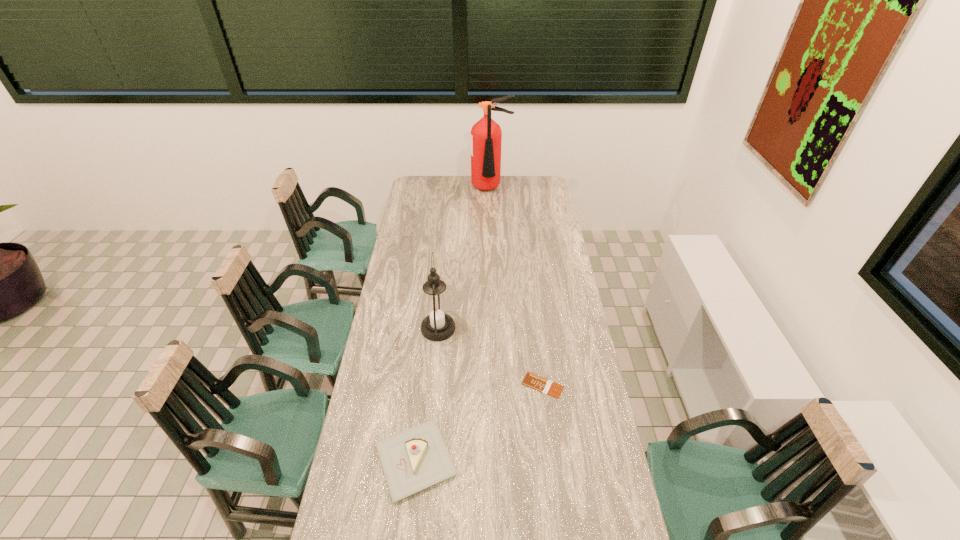
You are a GUI agent. You are given a task and a screenshot of the screen. Output one action in this format:
    pyautogui.click(x=<x>, y=<y>)
    Task: Click on the free space between the tallest object and the oil lamp
    The height and width of the screenshot is (540, 960).
    Given the screenshot: What is the action you would take?
    pyautogui.click(x=465, y=259)

This screenshot has width=960, height=540. I want to click on empty location between the chocolate bar and the third shortest object, so click(491, 357).

I want to click on unoccupied area between the second farthest object and the tallest object, so click(465, 259).

At what (x,y) coordinates should I click in order to perform the action: click on free area in between the third shortest object and the cake. Please return your answer as a coordinate pair (x, y). This screenshot has width=960, height=540. Looking at the image, I should click on (427, 394).

The height and width of the screenshot is (540, 960). In order to click on free space between the chocolate bar and the cake in this screenshot , I will do `click(479, 422)`.

Image resolution: width=960 pixels, height=540 pixels. I want to click on free space between the nearest object and the second farthest object, so click(x=427, y=394).

Locate an element on the screen. unoccupied position between the oil lamp and the shortest object is located at coordinates (491, 357).

Locate an element on the screen. the third closest object relative to the farthest object is located at coordinates (417, 458).

Where is `object that is the closest one to the chocolate bar`? The width and height of the screenshot is (960, 540). object that is the closest one to the chocolate bar is located at coordinates (417, 458).

At what (x,y) coordinates should I click in order to perform the action: click on vacant space that satisfies the following two spatial constraints: 1. on the back side of the cake; 2. on the right side of the shortest object. Please return your answer as a coordinate pair (x, y). Looking at the image, I should click on (424, 385).